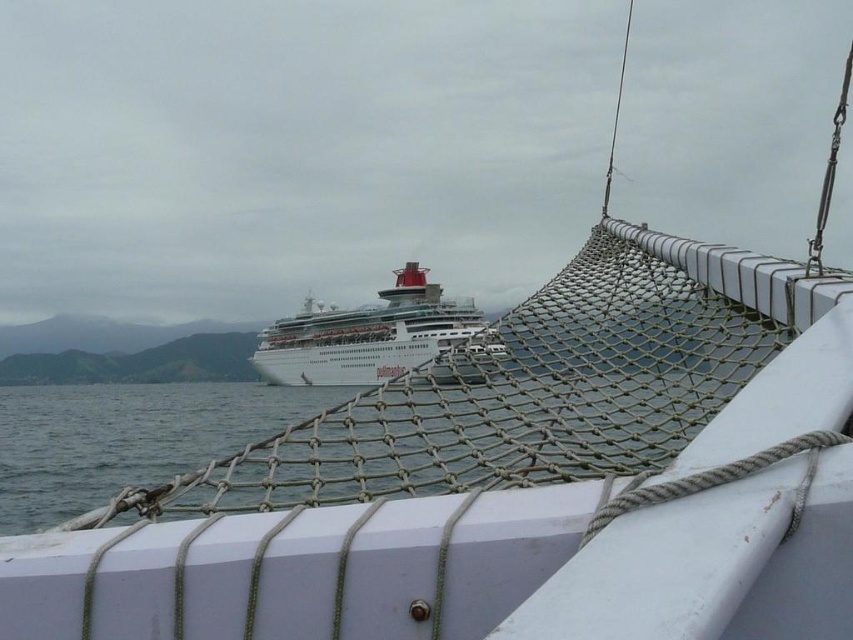
Question: Does clear water at center have a larger size compared to white glossy cruise ship at center?

Choices:
 (A) yes
 (B) no

Answer: (A)

Question: Which point is closer to the camera?

Choices:
 (A) (1, 376)
 (B) (471, 308)

Answer: (B)

Question: Among these points, which one is nearest to the camera?

Choices:
 (A) (416, 340)
 (B) (122, 419)

Answer: (A)

Question: Can you confirm if clear water at center is positioned to the right of white glossy cruise ship at center?

Choices:
 (A) yes
 (B) no

Answer: (B)

Question: Can you confirm if clear water at center is positioned to the right of white glossy cruise ship at center?

Choices:
 (A) yes
 (B) no

Answer: (B)

Question: Which point is closer to the camera?

Choices:
 (A) (368, 348)
 (B) (61, 368)

Answer: (A)